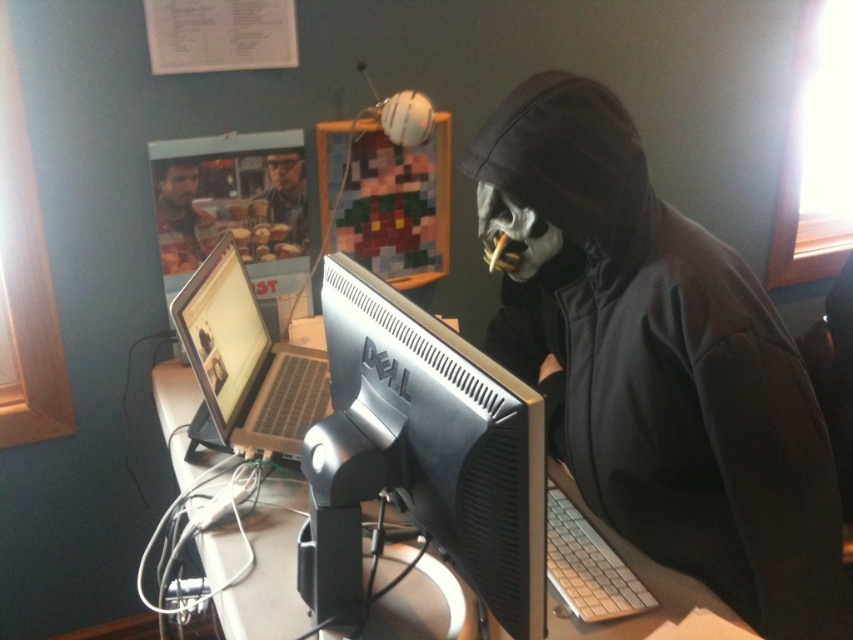
You are a technician trying to fix a connection issue between the silver metallic laptop at left and the matte plastic cup at upper center. What is the spatial relationship between these two items that might be causing the problem?

A: The silver metallic laptop at left is in front of the matte plastic cup at upper center, which might block the connection between them.

Consider the image. You are setting up a new monitor stand for the silver metallic laptop at left. According to the scene, where should you place the stand relative to the matte gray desk at center?

The matte gray desk at center is below the silver metallic laptop at left, so you should place the stand on the matte gray desk at center below the laptop to position it correctly.